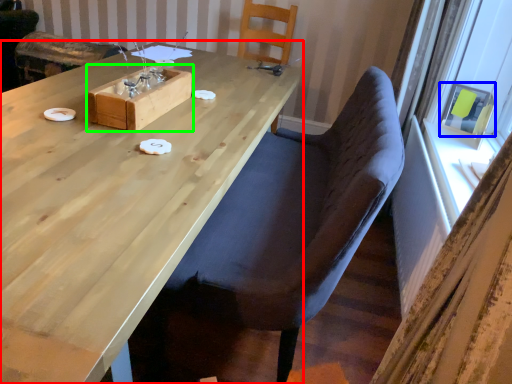
Question: Estimate the real-world distances between objects in this image. Which object is closer to table (highlighted by a red box), window screen (highlighted by a blue box) or box (highlighted by a green box)?

Choices:
 (A) window screen
 (B) box

Answer: (B)